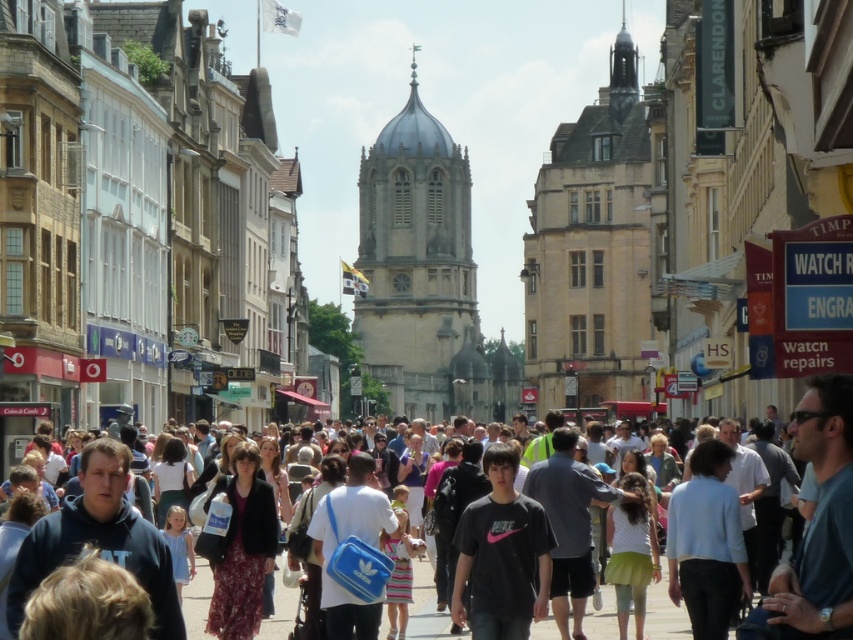
Question: Does stone tower at center have a smaller size compared to dark gray clothing at center?

Choices:
 (A) yes
 (B) no

Answer: (B)

Question: Is stone tower at center further to camera compared to dark gray clothing at center?

Choices:
 (A) yes
 (B) no

Answer: (A)

Question: Among these objects, which one is nearest to the camera?

Choices:
 (A) dark gray clothing at center
 (B) stone tower at center

Answer: (A)

Question: Which of the following is the closest to the observer?

Choices:
 (A) (596, 628)
 (B) (469, 221)

Answer: (A)

Question: Where is stone tower at center located in relation to dark gray clothing at center in the image?

Choices:
 (A) above
 (B) below

Answer: (A)